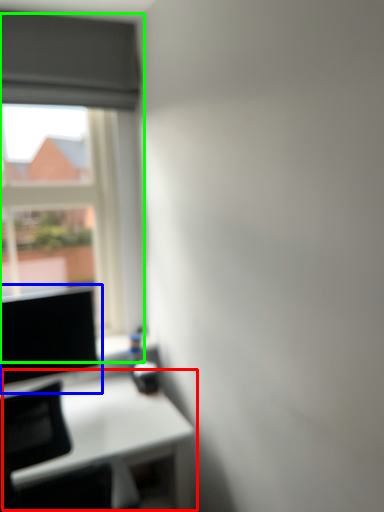
Question: Which object is positioned closest to table (highlighted by a red box)? Select from computer screen (highlighted by a blue box) and window (highlighted by a green box).

Choices:
 (A) computer screen
 (B) window

Answer: (A)